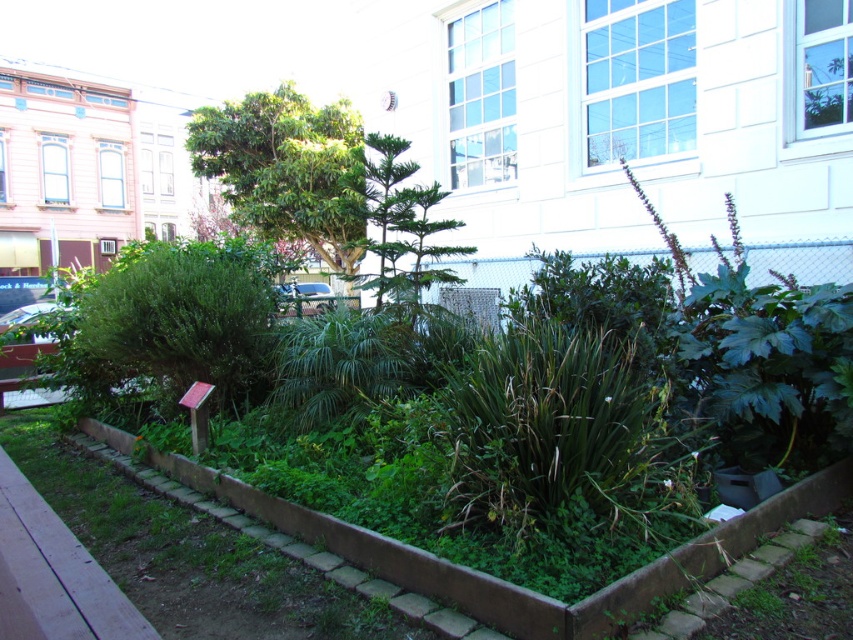
At what (x,y) coordinates should I click in order to perform the action: click on green leafy plant at center. Please return your answer as a coordinate pair (x, y). The width and height of the screenshot is (853, 640). Looking at the image, I should click on (511, 582).

Is point (96, 433) closer to camera compared to point (364, 220)?

No, (96, 433) is behind (364, 220).

Where is `green leafy plant at center`? The image size is (853, 640). green leafy plant at center is located at coordinates (511, 582).

Is green leafy bush at center-left above green leafy tree at center?

No.

Is point (239, 348) farther from camera compared to point (341, 220)?

No, it is not.

At what (x,y) coordinates should I click in order to perform the action: click on green leafy bush at center-left. Please return your answer as a coordinate pair (x, y). This screenshot has width=853, height=640. Looking at the image, I should click on (177, 323).

The width and height of the screenshot is (853, 640). What are the coordinates of `green leafy bush at center-left` in the screenshot? It's located at (177, 323).

Is green leafy plant at center thinner than green leafy bush at center-left?

No, green leafy plant at center is not thinner than green leafy bush at center-left.

Who is higher up, green leafy plant at center or green leafy bush at center-left?

green leafy bush at center-left

Between point (386, 570) and point (155, 404), which one is positioned behind?

The point (155, 404) is behind.

Where is `green leafy plant at center`? The image size is (853, 640). green leafy plant at center is located at coordinates (511, 582).